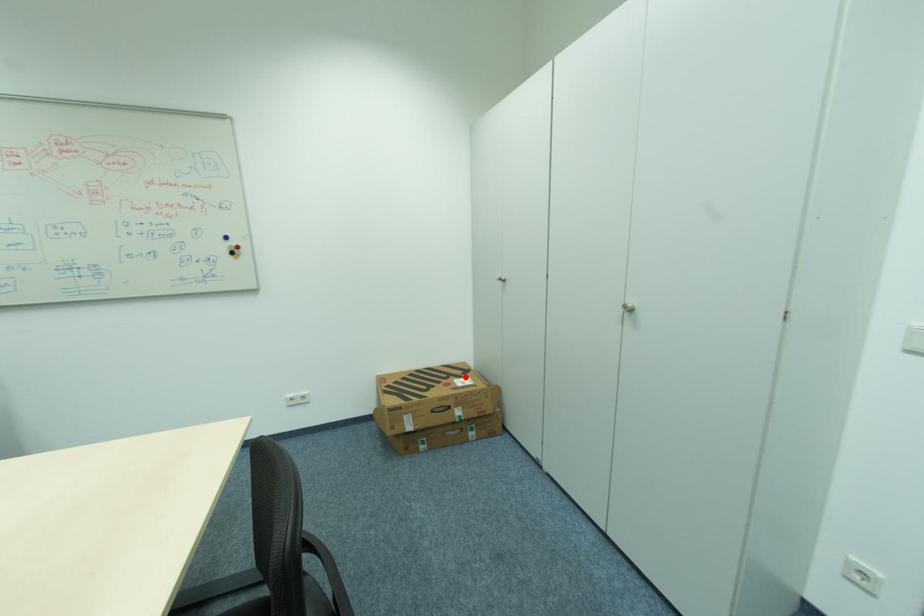
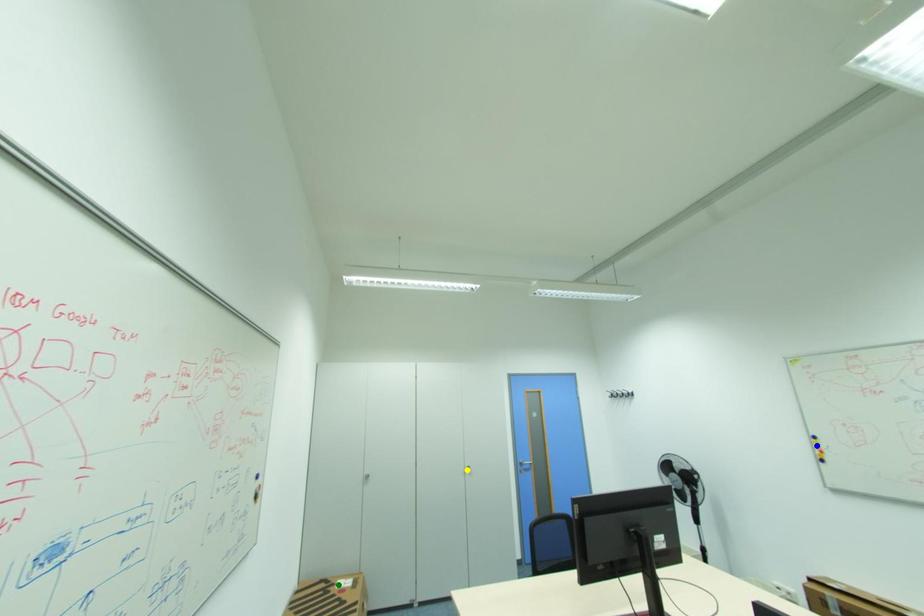
Question: I am providing you with two images of the same scene from different viewpoints. A red point is marked on the first image. You are given multiple points on the second image. In image 2, which mark is for the same physical point as the one in image 1?

Choices:
 (A) green point
 (B) blue point
 (C) yellow point

Answer: (A)